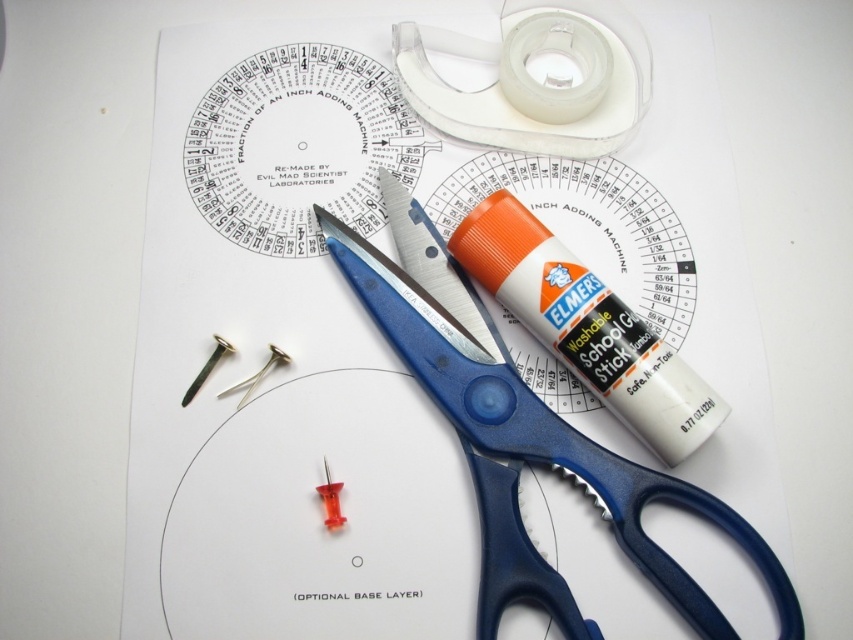
Question: Which object is positioned farthest from the silver metallic nails at center?

Choices:
 (A) transparent plastic tape at upper right
 (B) blue plastic scissors at upper center

Answer: (A)

Question: Which point is farther to the camera?

Choices:
 (A) (694, 580)
 (B) (277, 364)

Answer: (B)

Question: Can you confirm if transparent plastic tape at upper right is wider than silver metallic nails at center?

Choices:
 (A) no
 (B) yes

Answer: (B)

Question: Is transparent plastic tape at upper center closer to camera compared to transparent plastic tape at upper right?

Choices:
 (A) no
 (B) yes

Answer: (B)

Question: Which object is closer to the camera taking this photo?

Choices:
 (A) blue plastic scissors at upper center
 (B) transparent plastic tape at upper center
 (C) transparent plastic tape at upper right

Answer: (A)

Question: Can you confirm if transparent plastic tape at upper right is smaller than silver metallic nails at center?

Choices:
 (A) yes
 (B) no

Answer: (B)